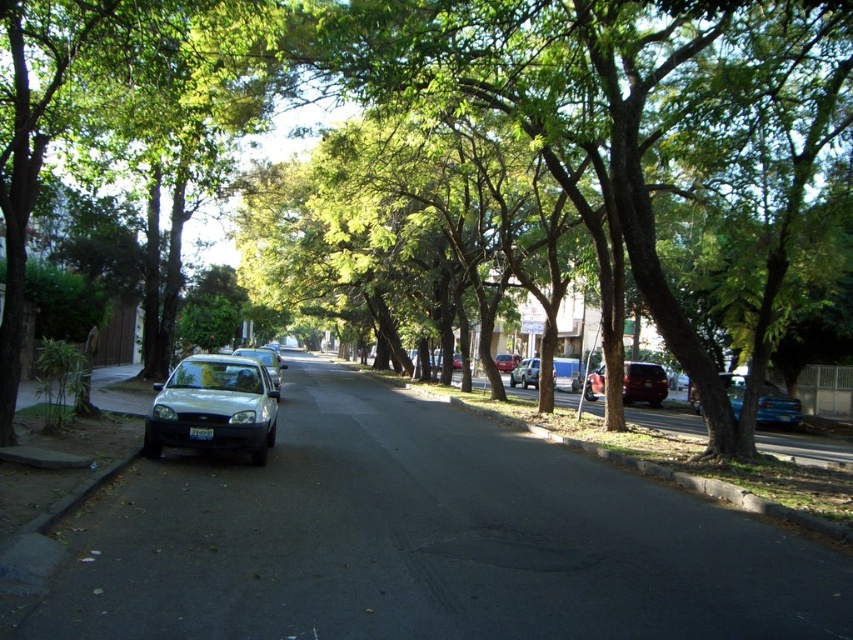
You are standing on the sidewalk looking down the street. There are two points marked on the road ahead of you. The first point is at coordinates point (770, 394) and the second is at point (627, 394). Which point is closer to your current position?

Point (770, 394) is closer to the camera than point (627, 394), so the first point is closer to your current position.

You are a delivery driver who needs to park your 2.5 meter wide truck between the metallic blue sedan at center and the shiny red suv at right. Based on the scene, can your truck fit in the space between them?

The metallic blue sedan at center is wider than the shiny red suv at right. Since the truck is 2.5 meters wide, it depends on the exact space between them. However, since the sedan is wider, the space might be narrower than the SUV side. Without exact measurements, it is uncertain if the truck can fit.

Consider the image. You are a delivery driver who needs to park your truck between the metallic blue sedan at center and the shiny red suv at right. Your truck is 6 meters long. Can you fit your truck in the space between them?

The metallic blue sedan at center is larger than the shiny red suv at right, but the description does not provide the exact distance between them. Without knowing the space between the two vehicles, it is impossible to determine if the truck can fit.